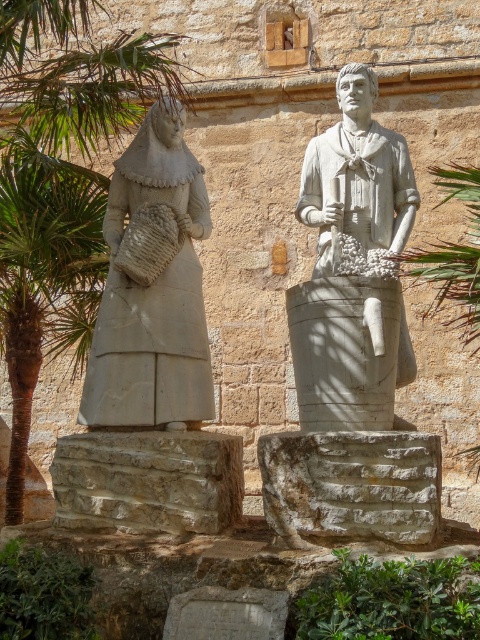
You are standing 50 meters away from a point marked at coordinates point (20, 477). Can you reach that point without moving closer than 45 meters?

The distance of point (20, 477) from viewer is 45.78 meters, so yes, you can reach that point without moving closer than 45 meters because the distance is just over 45 meters.